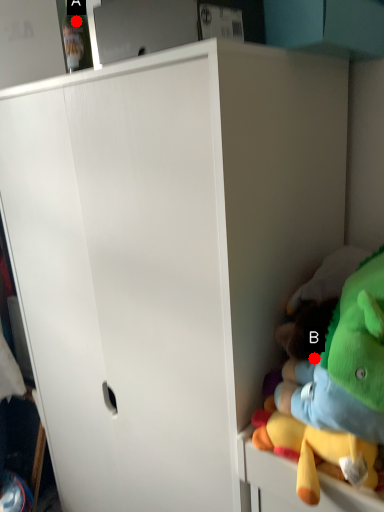
Question: Two points are circled on the image, labeled by A and B beside each circle. Which point is closer to the camera?

Choices:
 (A) A is closer
 (B) B is closer

Answer: (B)